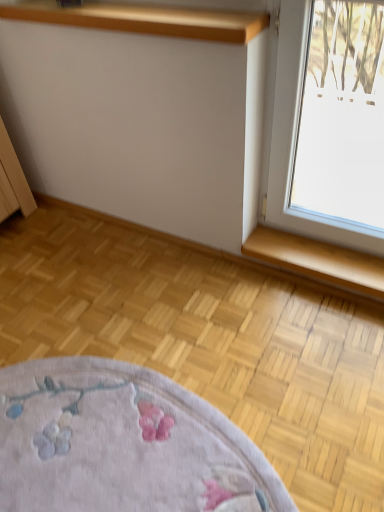
What are the coordinates of `blank space situated above wooden at lower right (from a real-world perspective)` in the screenshot? It's located at (331, 262).